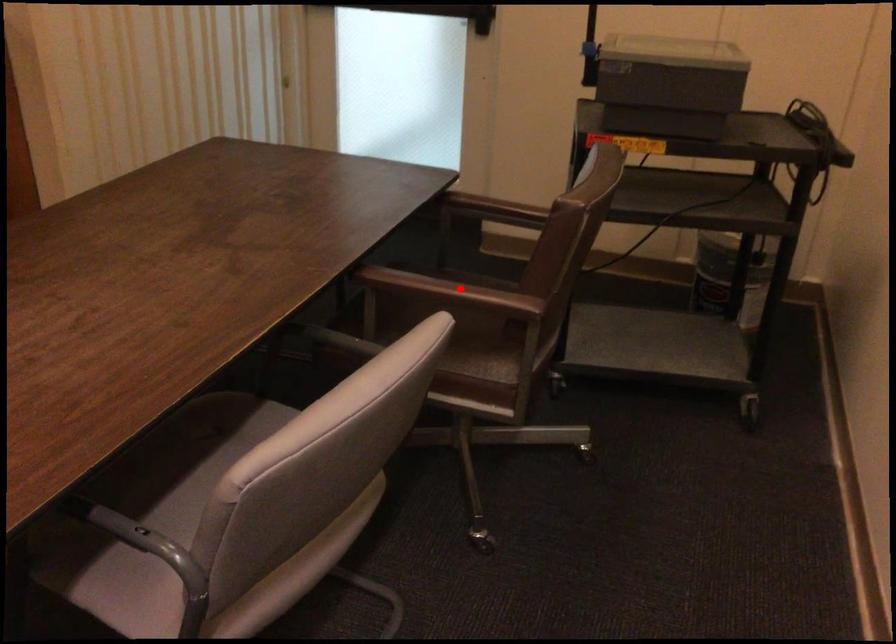
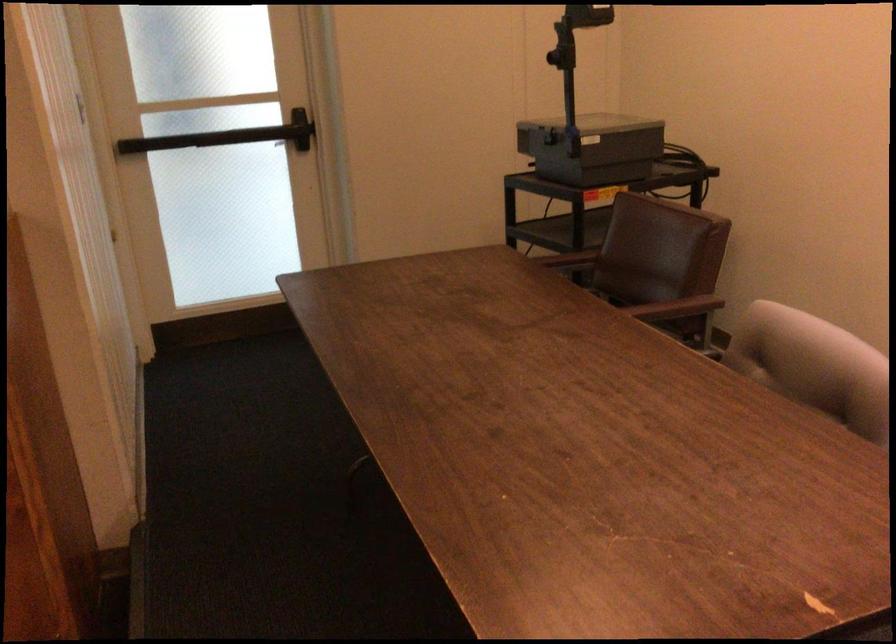
Question: I am providing you with two images of the same scene from different viewpoints. A red point is marked on the first image. Is the red point's position out of view in image 2?

Choices:
 (A) Yes
 (B) No

Answer: (A)